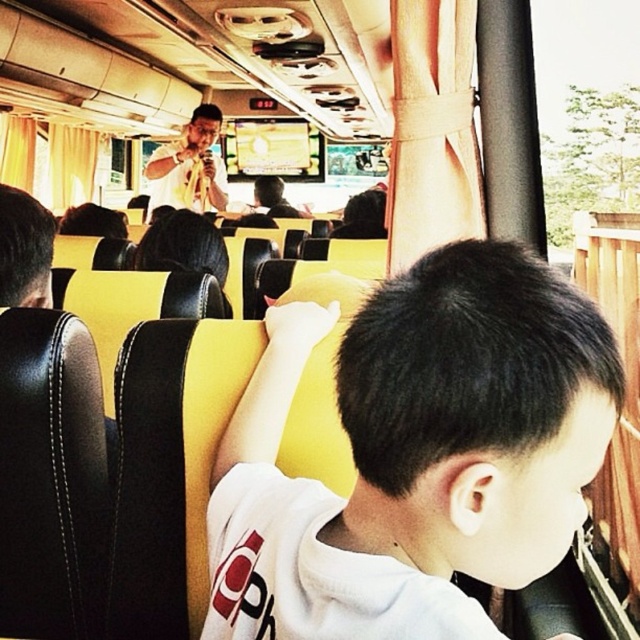
Question: Does white matte shirt at center have a smaller size compared to matte yellow shirt at upper center?

Choices:
 (A) no
 (B) yes

Answer: (B)

Question: Which point is farther from the camera taking this photo?

Choices:
 (A) (380, 356)
 (B) (179, 152)

Answer: (B)

Question: Does white matte shirt at center have a smaller size compared to matte yellow shirt at upper center?

Choices:
 (A) no
 (B) yes

Answer: (B)

Question: Is the position of white matte shirt at center less distant than that of matte yellow shirt at upper center?

Choices:
 (A) yes
 (B) no

Answer: (A)

Question: Which point is farther from the camera taking this photo?

Choices:
 (A) (209, 192)
 (B) (296, 557)

Answer: (A)